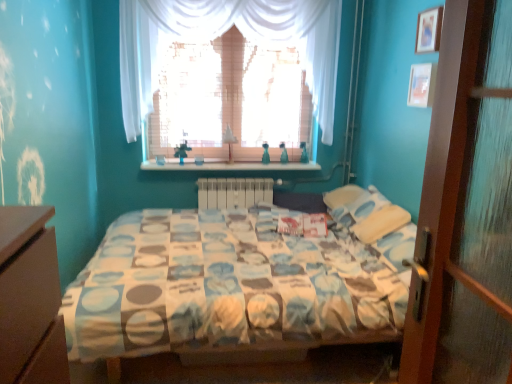
The width and height of the screenshot is (512, 384). Describe the element at coordinates (221, 34) in the screenshot. I see `white sheer curtain at upper center` at that location.

Measure the distance between point (321, 79) and camera.

They are 3.55 meters apart.

At what (x,y) coordinates should I click in order to perform the action: click on white plastic radiator at center. Please return your answer as a coordinate pair (x, y). Looking at the image, I should click on (233, 192).

This screenshot has height=384, width=512. Identify the location of white sheer curtain at upper center. (221, 34).

Consider the image. Does white plastic radiator at center have a lesser width compared to wooden shelf at center?

Yes.

In the image, is white plastic radiator at center positioned in front of or behind wooden shelf at center?

Clearly, white plastic radiator at center is behind wooden shelf at center.

Does white plastic radiator at center appear on the right side of wooden shelf at center?

Indeed, white plastic radiator at center is positioned on the right side of wooden shelf at center.

From the image's perspective, between wooden shelf at center and white sheer curtain at upper center, which one is located above?

white sheer curtain at upper center is shown above in the image.

Based on the photo, is wooden shelf at center positioned before white sheer curtain at upper center?

No, wooden shelf at center is further to the viewer.

From a real-world perspective, which object stands above the other?

In real-world perspective, white sheer curtain at upper center is above.

Between point (315, 167) and point (332, 32), which one is positioned behind?

The point (315, 167) is farther.

Is wooden shelf at center positioned in front of wooden picture frame at upper right, the 1th picture frame when ordered from bottom to top?

No.

Locate an element on the screen. The image size is (512, 384). the 1st picture frame above the wooden shelf at center (from a real-world perspective) is located at coordinates (422, 85).

Is wooden shelf at center outside of wooden picture frame at upper right, the 2th picture frame positioned from the top?

wooden shelf at center lies outside wooden picture frame at upper right, the 2th picture frame positioned from the top,'s area.

Looking at their sizes, would you say wooden shelf at center is wider or thinner than wooden picture frame at upper right, the 1th picture frame when ordered from bottom to top?

Considering their sizes, wooden shelf at center looks broader than wooden picture frame at upper right, the 1th picture frame when ordered from bottom to top.

Does white sheer curtain at upper center turn towards white plastic radiator at center?

No, white sheer curtain at upper center is not turned towards white plastic radiator at center.

Does white sheer curtain at upper center have a lesser width compared to white plastic radiator at center?

No.

Is the position of white sheer curtain at upper center less distant than that of white plastic radiator at center?

Yes, white sheer curtain at upper center is in front of white plastic radiator at center.

Is white sheer curtain at upper center completely or partially outside of white plastic radiator at center?

white sheer curtain at upper center lies outside white plastic radiator at center's area.

Is wooden shelf at center turned away from wooden picture frame at upper right, which is the first picture frame from top to bottom?

wooden shelf at center does not have its back to wooden picture frame at upper right, which is the first picture frame from top to bottom.

In the scene shown: From a real-world perspective, who is located higher, wooden shelf at center or wooden picture frame at upper right, which is the first picture frame from top to bottom?

In real-world perspective, wooden picture frame at upper right, which is the first picture frame from top to bottom, is above.

Measure the distance from wooden shelf at center to wooden picture frame at upper right, which is the first picture frame from top to bottom.

wooden shelf at center and wooden picture frame at upper right, which is the first picture frame from top to bottom, are 5.42 feet apart.

In the scene shown: Which object is further away from the camera taking this photo, wooden shelf at center or wooden picture frame at upper right, which is the first picture frame from top to bottom?

Positioned behind is wooden shelf at center.

Consider the image. Is wooden picture frame at upper right, which is the first picture frame from top to bottom, behind white sheer curtain at upper center?

No, it is in front of white sheer curtain at upper center.

Is point (419, 38) behind point (271, 12)?

No.

Does wooden picture frame at upper right, which appears as the second picture frame when ordered from the bottom, have a lesser height compared to white sheer curtain at upper center?

Indeed, wooden picture frame at upper right, which appears as the second picture frame when ordered from the bottom, has a lesser height compared to white sheer curtain at upper center.

Can you confirm if wooden picture frame at upper right, which is the first picture frame from top to bottom, is bigger than white sheer curtain at upper center?

Actually, wooden picture frame at upper right, which is the first picture frame from top to bottom, might be smaller than white sheer curtain at upper center.

In terms of size, does white plastic radiator at center appear bigger or smaller than wooden picture frame at upper right, which is the first picture frame from top to bottom?

In the image, white plastic radiator at center appears to be larger than wooden picture frame at upper right, which is the first picture frame from top to bottom.

From a real-world perspective, is white plastic radiator at center over wooden picture frame at upper right, which appears as the second picture frame when ordered from the bottom?

No.

Considering the relative positions of white plastic radiator at center and wooden picture frame at upper right, which appears as the second picture frame when ordered from the bottom, in the image provided, is white plastic radiator at center behind wooden picture frame at upper right, which appears as the second picture frame when ordered from the bottom,?

Yes, it is.

Would you consider white plastic radiator at center to be distant from wooden picture frame at upper right, which is the first picture frame from top to bottom?

white plastic radiator at center is positioned a significant distance from wooden picture frame at upper right, which is the first picture frame from top to bottom.

This screenshot has height=384, width=512. I want to click on window sill to the left of white plastic radiator at center, so click(227, 166).

Where is `curtain that appears in front of the wooden shelf at center`? This screenshot has height=384, width=512. curtain that appears in front of the wooden shelf at center is located at coordinates (221, 34).

When comparing their distances from wooden picture frame at upper right, the 1th picture frame when ordered from bottom to top, does wooden picture frame at upper right, which appears as the second picture frame when ordered from the bottom, or white sheer curtain at upper center seem further?

Based on the image, white sheer curtain at upper center appears to be further to wooden picture frame at upper right, the 1th picture frame when ordered from bottom to top.

Which object lies nearer to the anchor point wooden picture frame at upper right, which appears as the second picture frame when ordered from the bottom, wooden picture frame at upper right, the 1th picture frame when ordered from bottom to top, or white sheer curtain at upper center?

Based on the image, wooden picture frame at upper right, the 1th picture frame when ordered from bottom to top, appears to be nearer to wooden picture frame at upper right, which appears as the second picture frame when ordered from the bottom.

When comparing their distances from wooden shelf at center, does wooden picture frame at upper right, which appears as the second picture frame when ordered from the bottom, or white plastic radiator at center seem further?

wooden picture frame at upper right, which appears as the second picture frame when ordered from the bottom.

When comparing their distances from white plastic radiator at center, does white sheer curtain at upper center or wooden picture frame at upper right, the 1th picture frame when ordered from bottom to top, seem further?

wooden picture frame at upper right, the 1th picture frame when ordered from bottom to top, is further to white plastic radiator at center.

Estimate the real-world distances between objects in this image. Which object is closer to wooden shelf at center, white sheer curtain at upper center or wooden picture frame at upper right, which appears as the second picture frame when ordered from the bottom?

Based on the image, white sheer curtain at upper center appears to be nearer to wooden shelf at center.

Estimate the real-world distances between objects in this image. Which object is closer to wooden picture frame at upper right, the 1th picture frame when ordered from bottom to top, wooden shelf at center or white plastic radiator at center?

wooden shelf at center is positioned closer to the anchor wooden picture frame at upper right, the 1th picture frame when ordered from bottom to top.

Based on their spatial positions, is wooden shelf at center or wooden picture frame at upper right, which is the first picture frame from top to bottom, closer to wooden picture frame at upper right, the 2th picture frame positioned from the top?

wooden picture frame at upper right, which is the first picture frame from top to bottom, lies closer to wooden picture frame at upper right, the 2th picture frame positioned from the top, than the other object.

Considering their positions, is wooden shelf at center positioned closer to wooden picture frame at upper right, which is the first picture frame from top to bottom, than white sheer curtain at upper center?

white sheer curtain at upper center is closer to wooden picture frame at upper right, which is the first picture frame from top to bottom.

Locate an element on the screen. window sill between white sheer curtain at upper center and white plastic radiator at center in the up-down direction is located at coordinates (227, 166).

The height and width of the screenshot is (384, 512). In order to click on picture frame between white sheer curtain at upper center and wooden picture frame at upper right, which appears as the second picture frame when ordered from the bottom, from left to right in this screenshot , I will do `click(422, 85)`.

The height and width of the screenshot is (384, 512). In order to click on radiator between wooden shelf at center and wooden picture frame at upper right, which is the first picture frame from top to bottom, from left to right in this screenshot , I will do `click(233, 192)`.

This screenshot has width=512, height=384. Identify the location of radiator situated between white sheer curtain at upper center and wooden picture frame at upper right, which appears as the second picture frame when ordered from the bottom, from left to right. click(233, 192).